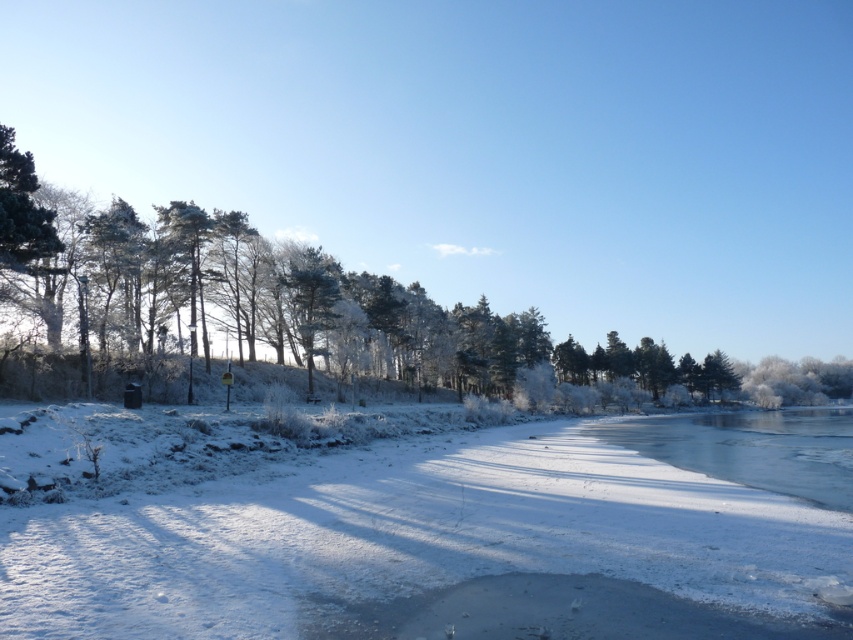
From the picture: Which is below, clear ice water at lower right or glossy snow-covered tree at center?

clear ice water at lower right is lower down.

Between point (735, 451) and point (318, 305), which one is positioned behind?

Positioned behind is point (318, 305).

Between point (746, 481) and point (323, 323), which one is positioned behind?

The point (323, 323) is more distant.

This screenshot has width=853, height=640. I want to click on clear ice water at lower right, so click(x=751, y=449).

Is white frosty snow at center to the left of glossy snow-covered tree at center from the viewer's perspective?

Incorrect, white frosty snow at center is not on the left side of glossy snow-covered tree at center.

Is white frosty snow at center smaller than glossy snow-covered tree at center?

Yes, white frosty snow at center is smaller than glossy snow-covered tree at center.

Identify the location of white frosty snow at center. The width and height of the screenshot is (853, 640). (407, 538).

Is point (677, 524) positioned behind point (766, 413)?

No, (677, 524) is closer to viewer.

Does white frosty snow at center appear under clear ice water at lower right?

No.

Is point (570, 488) closer to camera compared to point (753, 472)?

Yes, it is.

What are the coordinates of `white frosty snow at center` in the screenshot? It's located at (407, 538).